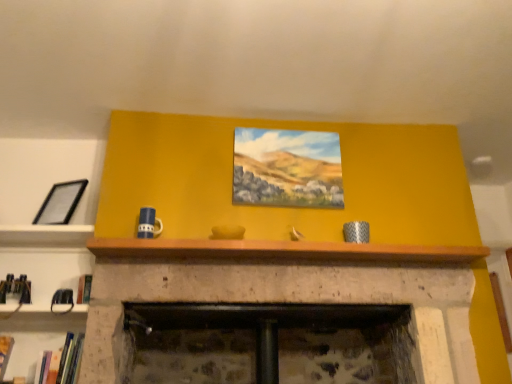
Describe the element at coordinates (5, 353) in the screenshot. This screenshot has width=512, height=384. I see `hardcover book at lower left, which appears as the second book when viewed from the right` at that location.

Identify the location of black matte picture frame at left, which appears as the 2th picture frame when viewed from the right. The image size is (512, 384). (61, 203).

Image resolution: width=512 pixels, height=384 pixels. In order to click on oil painting at center, placed as the 2th picture frame when sorted from left to right in this screenshot , I will do `click(287, 168)`.

Locate an element on the screen. The width and height of the screenshot is (512, 384). hardcover book at lower left, which is counted as the second book, starting from the left is located at coordinates (61, 362).

Where is `hardcover book at lower left, the 1th book viewed from the left`? The height and width of the screenshot is (384, 512). hardcover book at lower left, the 1th book viewed from the left is located at coordinates pyautogui.click(x=5, y=353).

Looking at this image, would you say oil painting at center, which is counted as the first picture frame, starting from the right, is part of hardcover book at lower left, placed as the 1th book when sorted from right to left,'s contents?

No, oil painting at center, which is counted as the first picture frame, starting from the right, is located outside of hardcover book at lower left, placed as the 1th book when sorted from right to left.

From a real-world perspective, is hardcover book at lower left, which is counted as the second book, starting from the left, above or below oil painting at center, placed as the 2th picture frame when sorted from left to right?

hardcover book at lower left, which is counted as the second book, starting from the left, is situated lower than oil painting at center, placed as the 2th picture frame when sorted from left to right, in the real world.

Consider the image. How different are the orientations of hardcover book at lower left, which is counted as the second book, starting from the left, and oil painting at center, placed as the 2th picture frame when sorted from left to right, in degrees?

They differ by 3.59 degrees in their facing directions.

From the image's perspective, is hardcover book at lower left, which is counted as the second book, starting from the left, on top of oil painting at center, which is counted as the first picture frame, starting from the right?

No, from the image's perspective, hardcover book at lower left, which is counted as the second book, starting from the left, is not on top of oil painting at center, which is counted as the first picture frame, starting from the right.

Between oil painting at center, which is counted as the first picture frame, starting from the right, and hardcover book at lower left, placed as the 1th book when sorted from right to left, which one has smaller size?

hardcover book at lower left, placed as the 1th book when sorted from right to left.

From the picture: Is oil painting at center, placed as the 2th picture frame when sorted from left to right, taller or shorter than hardcover book at lower left, placed as the 1th book when sorted from right to left?

Considering their sizes, oil painting at center, placed as the 2th picture frame when sorted from left to right, has more height than hardcover book at lower left, placed as the 1th book when sorted from right to left.

Which is correct: oil painting at center, placed as the 2th picture frame when sorted from left to right, is inside hardcover book at lower left, which is counted as the second book, starting from the left, or outside of it?

oil painting at center, placed as the 2th picture frame when sorted from left to right, is located beyond the bounds of hardcover book at lower left, which is counted as the second book, starting from the left.

Is oil painting at center, placed as the 2th picture frame when sorted from left to right, placed right next to wooden at upper center?

oil painting at center, placed as the 2th picture frame when sorted from left to right, and wooden at upper center are not in contact.

From a real-world perspective, relative to wooden at upper center, is oil painting at center, placed as the 2th picture frame when sorted from left to right, vertically above or below?

oil painting at center, placed as the 2th picture frame when sorted from left to right, is above wooden at upper center.

Which of these two, oil painting at center, placed as the 2th picture frame when sorted from left to right, or wooden at upper center, stands shorter?

wooden at upper center.

Measure the distance between oil painting at center, which is counted as the first picture frame, starting from the right, and wooden at upper center.

18.12 inches.

From the image's perspective, which book is the 2nd one below the wooden at upper center? Please provide its 2D coordinates.

[(5, 353)]

Does hardcover book at lower left, the 1th book viewed from the left, contain wooden at upper center?

No, wooden at upper center is not a part of hardcover book at lower left, the 1th book viewed from the left.

What's the angular difference between hardcover book at lower left, the 1th book viewed from the left, and wooden at upper center's facing directions?

The facing directions of hardcover book at lower left, the 1th book viewed from the left, and wooden at upper center are 1.91 degrees apart.

From a real-world perspective, which object stands above the other?

From a 3D spatial view, oil painting at center, placed as the 2th picture frame when sorted from left to right, is above.

Considering the relative sizes of wooden at upper center and oil painting at center, which is counted as the first picture frame, starting from the right, in the image provided, is wooden at upper center smaller than oil painting at center, which is counted as the first picture frame, starting from the right,?

Incorrect, wooden at upper center is not smaller in size than oil painting at center, which is counted as the first picture frame, starting from the right.

Is wooden at upper center positioned before oil painting at center, placed as the 2th picture frame when sorted from left to right?

Yes, wooden at upper center is closer to the camera.

What's the angular difference between wooden at upper center and oil painting at center, placed as the 2th picture frame when sorted from left to right,'s facing directions?

The angle between the facing direction of wooden at upper center and the facing direction of oil painting at center, placed as the 2th picture frame when sorted from left to right, is 0.818 degrees.

Looking at this image, is black matte picture frame at left, the 1th picture frame when ordered from left to right, outside of wooden at upper center?

Yes, black matte picture frame at left, the 1th picture frame when ordered from left to right, is outside of wooden at upper center.

The width and height of the screenshot is (512, 384). In order to click on mantle below the black matte picture frame at left, the 1th picture frame when ordered from left to right (from the image's perspective) in this screenshot , I will do `click(282, 251)`.

Who is more distant, black matte picture frame at left, which appears as the 2th picture frame when viewed from the right, or wooden at upper center?

black matte picture frame at left, which appears as the 2th picture frame when viewed from the right, is behind.

Is black matte picture frame at left, which appears as the 2th picture frame when viewed from the right, wider or thinner than wooden at upper center?

black matte picture frame at left, which appears as the 2th picture frame when viewed from the right, is thinner than wooden at upper center.

From a real-world perspective, is hardcover book at lower left, which appears as the second book when viewed from the right, on top of hardcover book at lower left, placed as the 1th book when sorted from right to left?

No, from a real-world perspective, hardcover book at lower left, which appears as the second book when viewed from the right, is not above hardcover book at lower left, placed as the 1th book when sorted from right to left.

Can you tell me how much hardcover book at lower left, the 1th book viewed from the left, and hardcover book at lower left, which is counted as the second book, starting from the left, differ in facing direction?

The facing directions of hardcover book at lower left, the 1th book viewed from the left, and hardcover book at lower left, which is counted as the second book, starting from the left, are 4.68 degrees apart.

Does hardcover book at lower left, which appears as the second book when viewed from the right, have a greater width compared to hardcover book at lower left, placed as the 1th book when sorted from right to left?

No, hardcover book at lower left, which appears as the second book when viewed from the right, is not wider than hardcover book at lower left, placed as the 1th book when sorted from right to left.

Can you confirm if hardcover book at lower left, the 1th book viewed from the left, is smaller than hardcover book at lower left, placed as the 1th book when sorted from right to left?

Correct, hardcover book at lower left, the 1th book viewed from the left, occupies less space than hardcover book at lower left, placed as the 1th book when sorted from right to left.

Identify the location of picture frame on the right of hardcover book at lower left, placed as the 1th book when sorted from right to left. (287, 168).

Locate an element on the screen. The image size is (512, 384). the 1st picture frame behind the hardcover book at lower left, placed as the 1th book when sorted from right to left is located at coordinates 287,168.

Based on their spatial positions, is oil painting at center, which is counted as the first picture frame, starting from the right, or wooden at upper center further from hardcover book at lower left, which is counted as the second book, starting from the left?

Based on the image, oil painting at center, which is counted as the first picture frame, starting from the right, appears to be further to hardcover book at lower left, which is counted as the second book, starting from the left.

Estimate the real-world distances between objects in this image. Which object is closer to hardcover book at lower left, which appears as the second book when viewed from the right, wooden at upper center or black matte picture frame at left, which appears as the 2th picture frame when viewed from the right?

black matte picture frame at left, which appears as the 2th picture frame when viewed from the right, lies closer to hardcover book at lower left, which appears as the second book when viewed from the right, than the other object.

Considering their positions, is wooden at upper center positioned closer to black matte picture frame at left, the 1th picture frame when ordered from left to right, than oil painting at center, placed as the 2th picture frame when sorted from left to right?

wooden at upper center is closer to black matte picture frame at left, the 1th picture frame when ordered from left to right.

Based on their spatial positions, is wooden at upper center or hardcover book at lower left, placed as the 1th book when sorted from right to left, closer to oil painting at center, which is counted as the first picture frame, starting from the right?

wooden at upper center is positioned closer to the anchor oil painting at center, which is counted as the first picture frame, starting from the right.

When comparing their distances from hardcover book at lower left, which appears as the second book when viewed from the right, does wooden at upper center or hardcover book at lower left, placed as the 1th book when sorted from right to left, seem further?

wooden at upper center is positioned further to the anchor hardcover book at lower left, which appears as the second book when viewed from the right.

From the picture: When comparing their distances from black matte picture frame at left, the 1th picture frame when ordered from left to right, does hardcover book at lower left, placed as the 1th book when sorted from right to left, or oil painting at center, placed as the 2th picture frame when sorted from left to right, seem further?

Based on the image, oil painting at center, placed as the 2th picture frame when sorted from left to right, appears to be further to black matte picture frame at left, the 1th picture frame when ordered from left to right.

Based on their spatial positions, is hardcover book at lower left, the 1th book viewed from the left, or hardcover book at lower left, placed as the 1th book when sorted from right to left, closer to oil painting at center, which is counted as the first picture frame, starting from the right?

The object closer to oil painting at center, which is counted as the first picture frame, starting from the right, is hardcover book at lower left, placed as the 1th book when sorted from right to left.

Looking at the image, which one is located further to wooden at upper center, black matte picture frame at left, which appears as the 2th picture frame when viewed from the right, or hardcover book at lower left, which is counted as the second book, starting from the left?

hardcover book at lower left, which is counted as the second book, starting from the left, lies further to wooden at upper center than the other object.

Find the location of a particular element. This screenshot has width=512, height=384. book between black matte picture frame at left, the 1th picture frame when ordered from left to right, and oil painting at center, which is counted as the first picture frame, starting from the right, from left to right is located at coordinates (61, 362).

This screenshot has height=384, width=512. What are the coordinates of `book between black matte picture frame at left, the 1th picture frame when ordered from left to right, and wooden at upper center, in the horizontal direction` in the screenshot? It's located at tap(61, 362).

Find the location of a particular element. book situated between hardcover book at lower left, which appears as the second book when viewed from the right, and oil painting at center, which is counted as the first picture frame, starting from the right, from left to right is located at coordinates (61, 362).

Identify the location of picture frame between hardcover book at lower left, which is counted as the second book, starting from the left, and wooden at upper center. (287, 168).